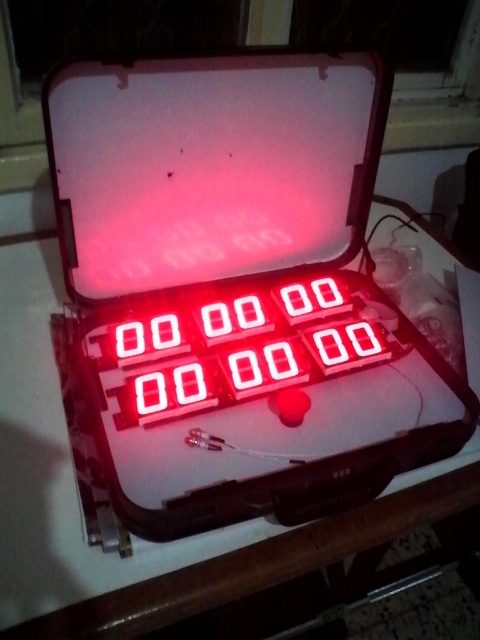
Question: Does white plastic case at center appear under red led display at center?

Choices:
 (A) no
 (B) yes

Answer: (A)

Question: Can you confirm if white plastic case at center is wider than red led display at center?

Choices:
 (A) yes
 (B) no

Answer: (A)

Question: Is white plastic case at center above red led display at center?

Choices:
 (A) yes
 (B) no

Answer: (A)

Question: Which point is farther to the camera?

Choices:
 (A) red led display at center
 (B) white plastic case at center

Answer: (A)